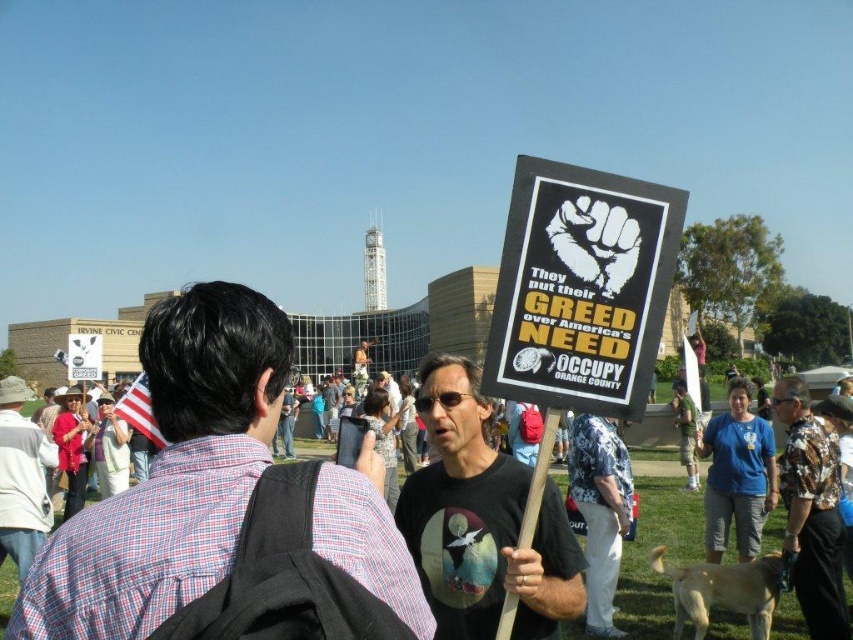
What do you see at coordinates (171, 474) in the screenshot? I see `plaid shirt at center` at bounding box center [171, 474].

The height and width of the screenshot is (640, 853). What are the coordinates of `plaid shirt at center` in the screenshot? It's located at (171, 474).

Can you confirm if black t-shirt at center is wider than floral shirt at center?

No.

Which is in front, point (489, 513) or point (808, 454)?

Positioned in front is point (489, 513).

What do you see at coordinates (480, 518) in the screenshot? The width and height of the screenshot is (853, 640). I see `black t-shirt at center` at bounding box center [480, 518].

Find the location of a particular element. black t-shirt at center is located at coordinates (480, 518).

Can you confirm if plaid shirt at center is positioned to the left of white hat at center?

Incorrect, plaid shirt at center is not on the left side of white hat at center.

Is plaid shirt at center further to camera compared to white hat at center?

No.

Who is more distant from viewer, (316,518) or (0,497)?

Point (0,497)

This screenshot has height=640, width=853. Find the location of `plaid shirt at center`. plaid shirt at center is located at coordinates (171, 474).